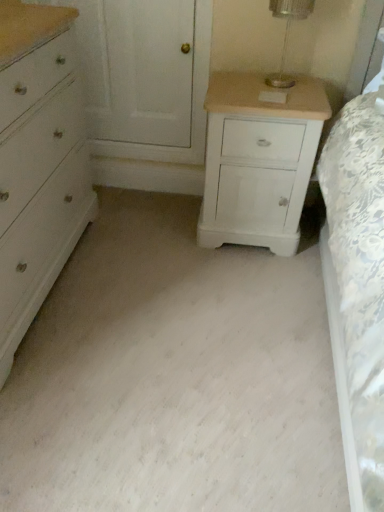
Question: Is clear glass table lamp at upper center at the left side of white painted wood chest of drawers at left?

Choices:
 (A) yes
 (B) no

Answer: (B)

Question: Would you consider clear glass table lamp at upper center to be distant from white painted wood chest of drawers at left?

Choices:
 (A) yes
 (B) no

Answer: (B)

Question: Can you confirm if clear glass table lamp at upper center is thinner than white painted wood chest of drawers at left?

Choices:
 (A) no
 (B) yes

Answer: (B)

Question: Does clear glass table lamp at upper center touch white painted wood chest of drawers at left?

Choices:
 (A) no
 (B) yes

Answer: (A)

Question: From the image's perspective, does clear glass table lamp at upper center appear higher than white painted wood chest of drawers at left?

Choices:
 (A) no
 (B) yes

Answer: (B)

Question: From a real-world perspective, relative to clear glass table lamp at upper center, is white painted wood chest of drawers at left vertically above or below?

Choices:
 (A) below
 (B) above

Answer: (A)

Question: Is white painted wood chest of drawers at left inside the boundaries of clear glass table lamp at upper center, or outside?

Choices:
 (A) outside
 (B) inside

Answer: (A)

Question: From their relative heights in the image, would you say white painted wood chest of drawers at left is taller or shorter than clear glass table lamp at upper center?

Choices:
 (A) tall
 (B) short

Answer: (A)

Question: Is white painted wood chest of drawers at left to the left or to the right of clear glass table lamp at upper center in the image?

Choices:
 (A) right
 (B) left

Answer: (B)

Question: Based on their sizes in the image, would you say white painted wood chest of drawers at left is bigger or smaller than white painted wood nightstand at right?

Choices:
 (A) big
 (B) small

Answer: (A)

Question: Is white painted wood chest of drawers at left wider or thinner than white painted wood nightstand at right?

Choices:
 (A) wide
 (B) thin

Answer: (A)

Question: Relative to white painted wood nightstand at right, is white painted wood chest of drawers at left in front or behind?

Choices:
 (A) front
 (B) behind

Answer: (A)

Question: From their relative heights in the image, would you say white painted wood chest of drawers at left is taller or shorter than white painted wood nightstand at right?

Choices:
 (A) tall
 (B) short

Answer: (A)

Question: Based on their positions, is white painted wood nightstand at right located to the left or right of clear glass table lamp at upper center?

Choices:
 (A) right
 (B) left

Answer: (B)

Question: In terms of size, does white painted wood nightstand at right appear bigger or smaller than clear glass table lamp at upper center?

Choices:
 (A) small
 (B) big

Answer: (B)